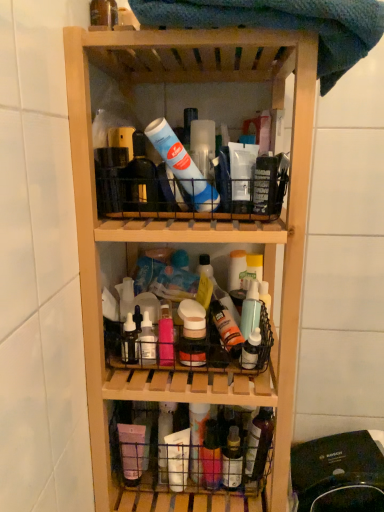
Question: Is translucent plastic spray bottle at center, which is the 1th bottle in right-to-left order, facing towards translucent plastic basket at lower center?

Choices:
 (A) no
 (B) yes

Answer: (A)

Question: Is translucent plastic spray bottle at center, the fourth bottle in the bottom-to-top sequence, wider than translucent plastic basket at lower center?

Choices:
 (A) yes
 (B) no

Answer: (B)

Question: Is translucent plastic spray bottle at center, the fourth bottle in the bottom-to-top sequence, oriented away from translucent plastic basket at lower center?

Choices:
 (A) no
 (B) yes

Answer: (A)

Question: From the image's perspective, is translucent plastic spray bottle at center, which ranks as the 2th bottle in top-to-bottom order, on translucent plastic basket at lower center?

Choices:
 (A) no
 (B) yes

Answer: (B)

Question: Does translucent plastic spray bottle at center, which is the 1th bottle in right-to-left order, appear on the right side of translucent plastic basket at lower center?

Choices:
 (A) no
 (B) yes

Answer: (B)

Question: Is black plastic vacuum cleaner at lower right in front of or behind translucent plastic spray bottle at center, which ranks as the 2th bottle in top-to-bottom order, in the image?

Choices:
 (A) front
 (B) behind

Answer: (A)

Question: From their relative heights in the image, would you say black plastic vacuum cleaner at lower right is taller or shorter than translucent plastic spray bottle at center, which ranks as the 2th bottle in top-to-bottom order?

Choices:
 (A) tall
 (B) short

Answer: (A)

Question: Do you think black plastic vacuum cleaner at lower right is within translucent plastic spray bottle at center, the fourth bottle in the bottom-to-top sequence, or outside of it?

Choices:
 (A) inside
 (B) outside

Answer: (B)

Question: From a real-world perspective, is black plastic vacuum cleaner at lower right above or below translucent plastic spray bottle at center, the fourth bottle in the bottom-to-top sequence?

Choices:
 (A) above
 (B) below

Answer: (B)

Question: From the image's perspective, is translucent plastic spray bottle at center, which appears as the fifth bottle when viewed from the left, positioned above or below translucent plastic bottle at upper left, positioned as the first bottle in left-to-right order?

Choices:
 (A) below
 (B) above

Answer: (A)

Question: Is translucent plastic spray bottle at center, which appears as the fifth bottle when viewed from the left, wider or thinner than translucent plastic bottle at upper left, marked as the fifth bottle in a bottom-to-top arrangement?

Choices:
 (A) thin
 (B) wide

Answer: (A)

Question: Do you think translucent plastic spray bottle at center, which appears as the fifth bottle when viewed from the left, is within translucent plastic bottle at upper left, marked as the fifth bottle in a bottom-to-top arrangement, or outside of it?

Choices:
 (A) inside
 (B) outside

Answer: (B)

Question: Considering the positions of translucent plastic spray bottle at center, the fourth bottle in the bottom-to-top sequence, and translucent plastic bottle at upper left, marked as the fifth bottle in a bottom-to-top arrangement, in the image, is translucent plastic spray bottle at center, the fourth bottle in the bottom-to-top sequence, taller or shorter than translucent plastic bottle at upper left, marked as the fifth bottle in a bottom-to-top arrangement,?

Choices:
 (A) short
 (B) tall

Answer: (B)

Question: Considering the positions of translucent plastic spray bottle at center, which is the 1th bottle in right-to-left order, and black plastic vacuum cleaner at lower right in the image, is translucent plastic spray bottle at center, which is the 1th bottle in right-to-left order, wider or thinner than black plastic vacuum cleaner at lower right?

Choices:
 (A) thin
 (B) wide

Answer: (A)

Question: Based on their positions, is translucent plastic spray bottle at center, which appears as the fifth bottle when viewed from the left, located to the left or right of black plastic vacuum cleaner at lower right?

Choices:
 (A) right
 (B) left

Answer: (B)